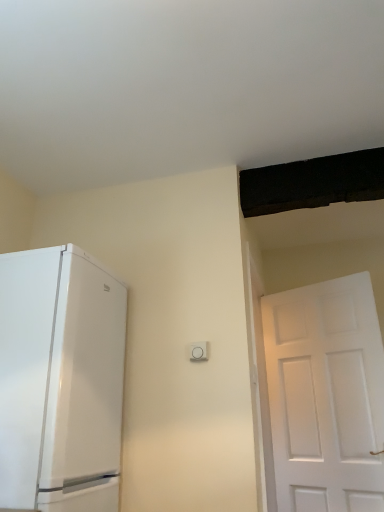
Question: Considering the relative positions of white glossy refrigerator at left and white plastic light switch at center in the image provided, is white glossy refrigerator at left to the right of white plastic light switch at center from the viewer's perspective?

Choices:
 (A) yes
 (B) no

Answer: (B)

Question: Is white glossy refrigerator at left positioned with its back to white plastic light switch at center?

Choices:
 (A) no
 (B) yes

Answer: (A)

Question: Does white glossy refrigerator at left lie in front of white plastic light switch at center?

Choices:
 (A) yes
 (B) no

Answer: (A)

Question: From the image's perspective, is white glossy refrigerator at left on white plastic light switch at center?

Choices:
 (A) yes
 (B) no

Answer: (B)

Question: Is white glossy refrigerator at left not inside white plastic light switch at center?

Choices:
 (A) yes
 (B) no

Answer: (A)

Question: Is white plastic light switch at center completely or partially inside white glossy refrigerator at left?

Choices:
 (A) yes
 (B) no

Answer: (B)

Question: Could you tell me if white plastic light switch at center is turned towards white glossy refrigerator at left?

Choices:
 (A) no
 (B) yes

Answer: (A)

Question: From the image's perspective, does white plastic light switch at center appear lower than white glossy refrigerator at left?

Choices:
 (A) no
 (B) yes

Answer: (A)

Question: Considering the relative sizes of white plastic light switch at center and white glossy refrigerator at left in the image provided, is white plastic light switch at center thinner than white glossy refrigerator at left?

Choices:
 (A) no
 (B) yes

Answer: (B)

Question: Does white plastic light switch at center appear on the left side of white glossy refrigerator at left?

Choices:
 (A) no
 (B) yes

Answer: (A)

Question: Is there a large distance between white plastic light switch at center and white glossy refrigerator at left?

Choices:
 (A) yes
 (B) no

Answer: (B)

Question: Can you confirm if white plastic light switch at center is wider than white glossy refrigerator at left?

Choices:
 (A) yes
 (B) no

Answer: (B)

Question: From their relative heights in the image, would you say white glossy refrigerator at left is taller or shorter than white plastic light switch at center?

Choices:
 (A) short
 (B) tall

Answer: (B)